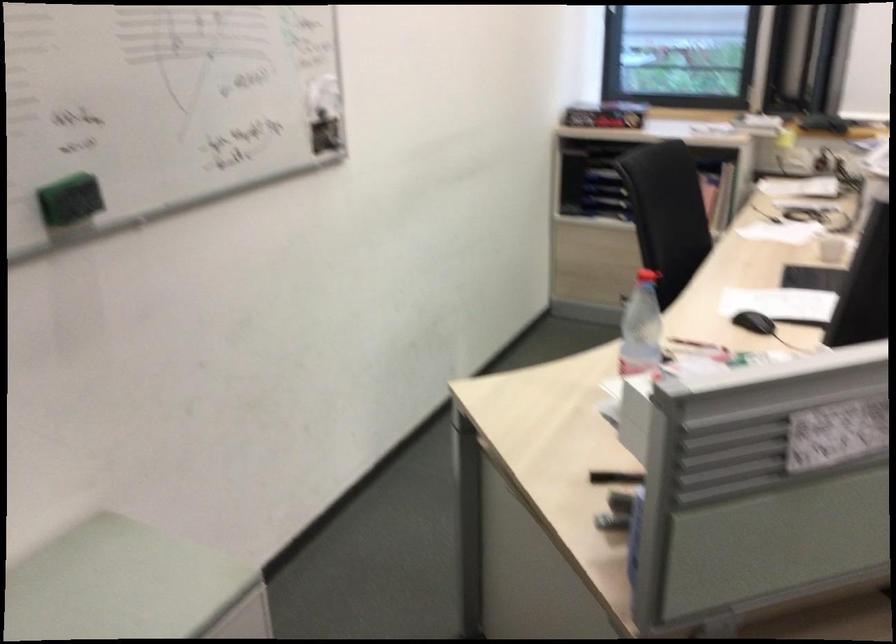
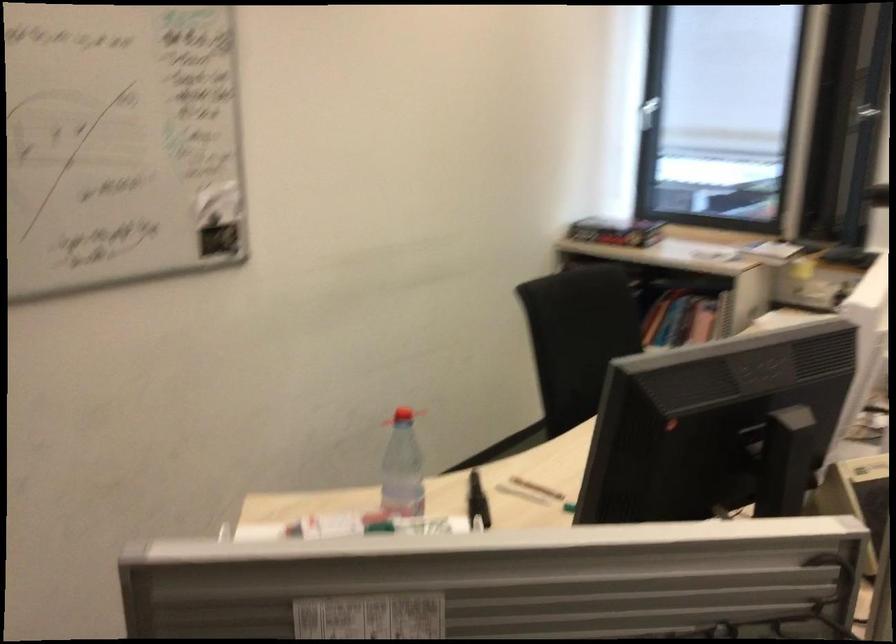
Locate, in the second image, the point that corresponds to the point at 615,118 in the first image.

(615, 232)